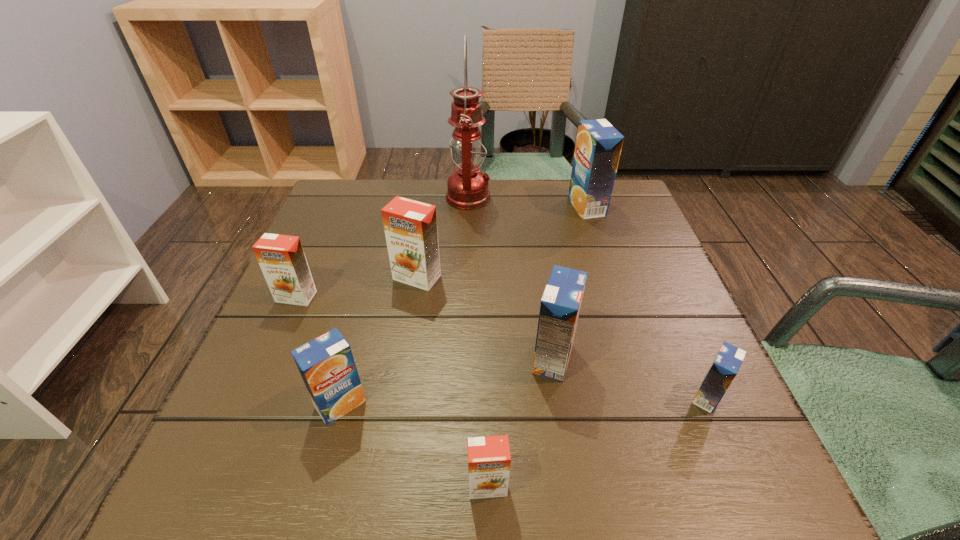
In order to click on red oil lamp in this screenshot , I will do `click(467, 187)`.

At what (x,y) coordinates should I click in order to perform the action: click on oil lamp. Please return your answer as a coordinate pair (x, y). Looking at the image, I should click on (467, 187).

This screenshot has width=960, height=540. What are the coordinates of `the second object from right to left` in the screenshot? It's located at (598, 147).

This screenshot has width=960, height=540. What are the coordinates of `the biggest blue orange_juice` in the screenshot? It's located at (598, 147).

Locate an element on the screen. The height and width of the screenshot is (540, 960). the biggest orange orange juice is located at coordinates (410, 226).

Identify the location of the third blue orange_juice from right to left. (560, 305).

Image resolution: width=960 pixels, height=540 pixels. Find the location of `the sixth object from left to right`. the sixth object from left to right is located at coordinates (560, 305).

At what (x,y) coordinates should I click in order to perform the action: click on the leftmost orange orange juice. Please return your answer as a coordinate pair (x, y). The image size is (960, 540). Looking at the image, I should click on (281, 258).

Find the location of `the second biggest orange orange juice`. the second biggest orange orange juice is located at coordinates (281, 258).

This screenshot has height=540, width=960. I want to click on the second smallest blue orange_juice, so [x=326, y=364].